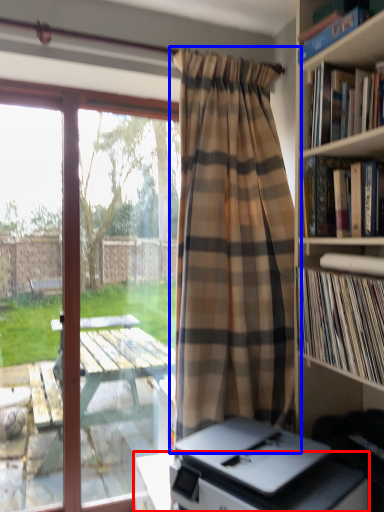
Question: Which of the following is the farthest to the observer, table (highlighted by a red box) or curtain (highlighted by a blue box)?

Choices:
 (A) table
 (B) curtain

Answer: (B)